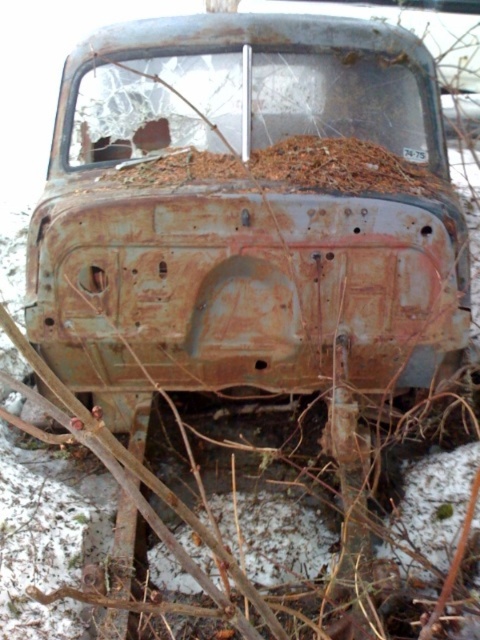
Question: Can you confirm if rusty metal car at center is positioned above rusty metal hood at center?

Choices:
 (A) yes
 (B) no

Answer: (B)

Question: Which point appears closest to the camera in this image?

Choices:
 (A) (179, 196)
 (B) (379, 161)

Answer: (A)

Question: Is rusty metal car at center positioned in front of rusty metal hood at center?

Choices:
 (A) no
 (B) yes

Answer: (B)

Question: Can you confirm if rusty metal car at center is positioned above rusty metal hood at center?

Choices:
 (A) yes
 (B) no

Answer: (B)

Question: Which of the following is the closest to the observer?

Choices:
 (A) rusty metal car at center
 (B) rusty metal hood at center

Answer: (A)